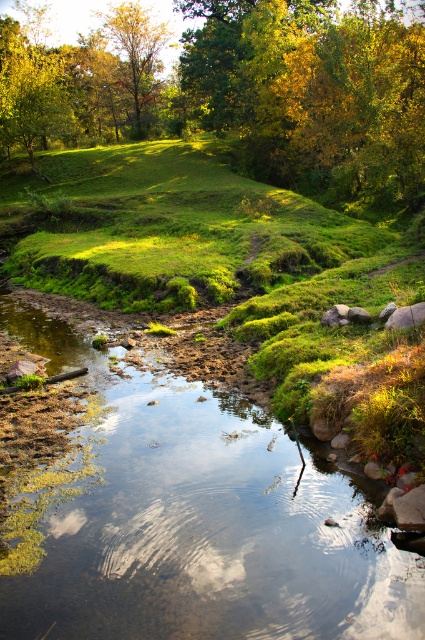
Question: Which object is the closest to the clear water stream at center?

Choices:
 (A) green leafy tree at upper center
 (B) golden yellow leaves at upper center

Answer: (A)

Question: Is green leafy tree at upper center further to camera compared to golden yellow leaves at upper center?

Choices:
 (A) no
 (B) yes

Answer: (A)

Question: Is clear water stream at center to the right of green leafy tree at upper center from the viewer's perspective?

Choices:
 (A) yes
 (B) no

Answer: (B)

Question: Can you confirm if clear water stream at center is positioned above golden yellow leaves at upper center?

Choices:
 (A) yes
 (B) no

Answer: (B)

Question: Which of the following is the closest to the observer?

Choices:
 (A) pyautogui.click(x=354, y=100)
 (B) pyautogui.click(x=141, y=12)

Answer: (A)

Question: Which of these objects is positioned closest to the green leafy tree at upper center?

Choices:
 (A) golden yellow leaves at upper center
 (B) clear water stream at center

Answer: (A)